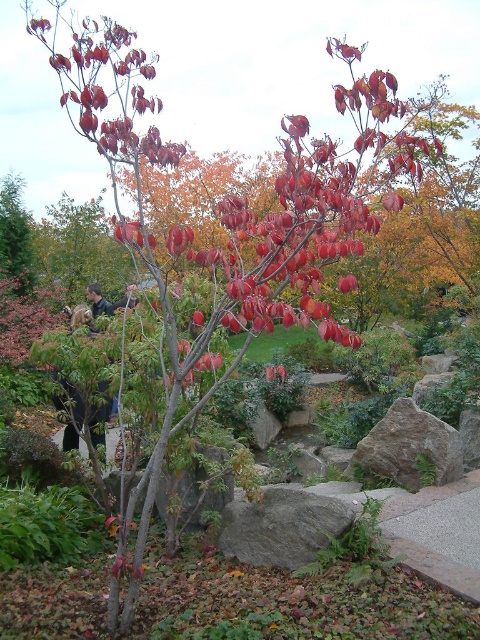
You are standing in the garden and want to place a small decoration between the gray rough rock at center and the gray rough rock at lower right. Based on their positions, which rock should the decoration be closer to in order to be centered between them?

The gray rough rock at center is in front of the gray rough rock at lower right, so to center the decoration between them, it should be closer to the gray rough rock at lower right.